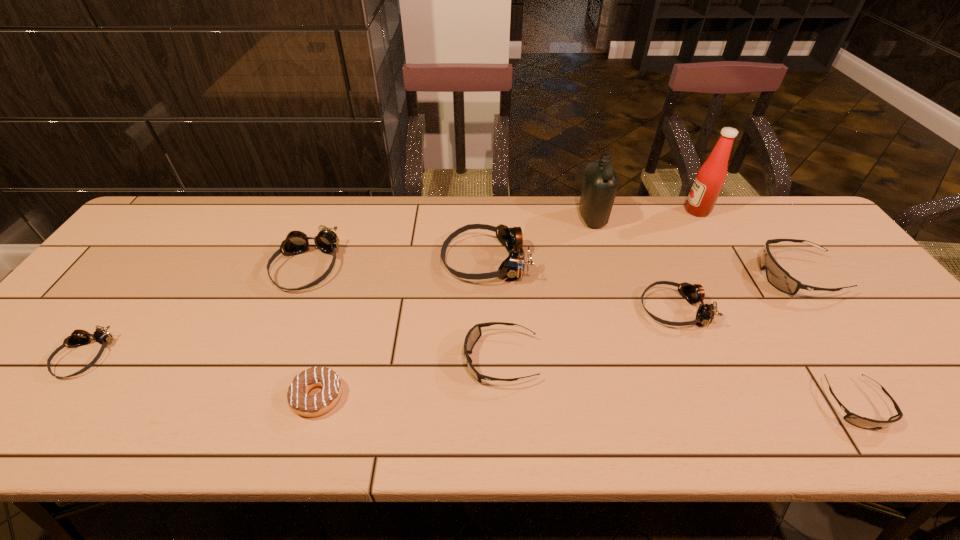
This screenshot has width=960, height=540. In order to click on red condiment in this screenshot , I will do (x=710, y=178).

This screenshot has height=540, width=960. I want to click on the tallest object, so click(x=710, y=178).

Find the location of a particular element. This screenshot has width=960, height=540. the ninth shortest object is located at coordinates (600, 184).

At what (x,y) coordinates should I click in order to perform the action: click on bottle. Please return your answer as a coordinate pair (x, y). The height and width of the screenshot is (540, 960). Looking at the image, I should click on (600, 184).

Where is `the tallest goggles`? The width and height of the screenshot is (960, 540). the tallest goggles is located at coordinates (513, 266).

This screenshot has width=960, height=540. I want to click on the eighth shortest object, so click(x=513, y=266).

Where is `the second bronze goggles from left to right`? the second bronze goggles from left to right is located at coordinates (296, 242).

Identify the location of the second goggles from left to right. (296, 242).

Identify the location of the biggest black goggles. The image size is (960, 540). (777, 276).

The height and width of the screenshot is (540, 960). Identify the location of the third biggest bronze goggles. (694, 293).